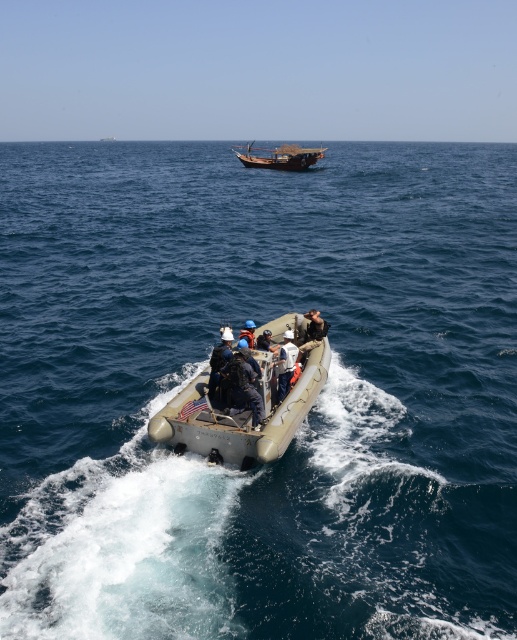
Is wooden sailboat at center shorter than dark brown leather jacket at center?

Incorrect, wooden sailboat at center's height does not fall short of dark brown leather jacket at center's.

In the scene shown: Measure the distance between wooden sailboat at center and camera.

65.80 meters

Where is `wooden sailboat at center`? The height and width of the screenshot is (640, 517). wooden sailboat at center is located at coordinates (280, 156).

Does beige rubber dinghy at center appear over wooden sailboat at center?

No, beige rubber dinghy at center is not above wooden sailboat at center.

Can you confirm if beige rubber dinghy at center is shorter than wooden sailboat at center?

Yes, beige rubber dinghy at center is shorter than wooden sailboat at center.

Is point (174, 396) in front of point (271, 168)?

Yes, point (174, 396) is in front of point (271, 168).

Where is `beige rubber dinghy at center`? This screenshot has height=640, width=517. beige rubber dinghy at center is located at coordinates (241, 416).

Consider the image. Measure the distance from beige rubber dinghy at center to dark gray rubber boat at center.

27.76 centimeters

At what (x,y) coordinates should I click in order to perform the action: click on beige rubber dinghy at center. Please return your answer as a coordinate pair (x, y). The width and height of the screenshot is (517, 640). Looking at the image, I should click on (241, 416).

The image size is (517, 640). Find the location of `beige rubber dinghy at center`. beige rubber dinghy at center is located at coordinates (241, 416).